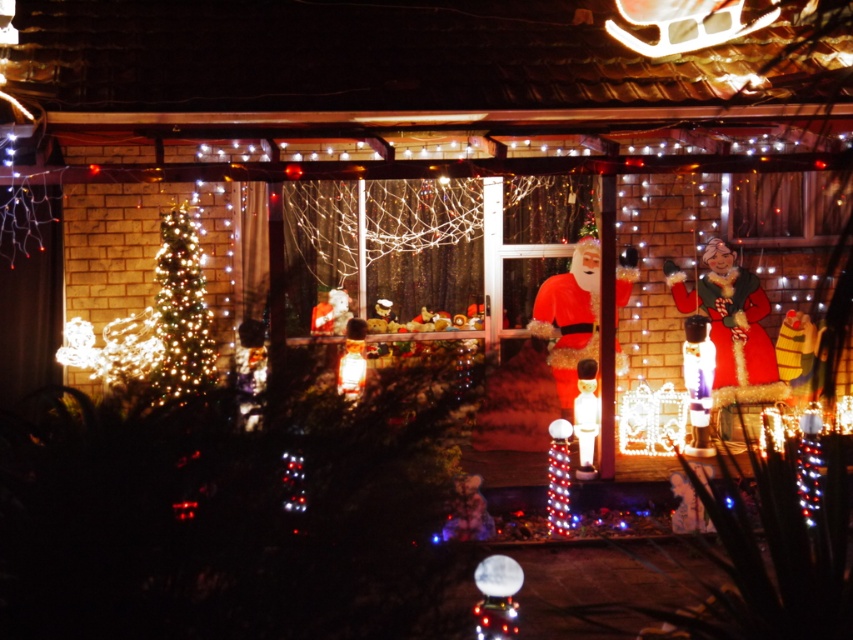
You are standing in front of the house in the Christmas scene. You want to place a gift under the matte red santa at right. Where should you put the gift?

You should place the gift under the matte red santa at right at point (730,328).

You are a visitor standing in front of the house and see the matte red santa at right and the matte white figure at center. Which one is higher up in the scene?

The matte red santa at right is higher up because it is located above the matte white figure at center.